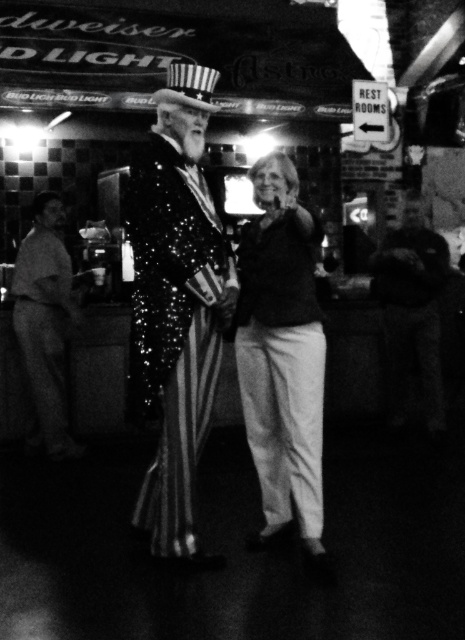
Question: Is sparkly sequined sailor at center smaller than matte black shirt at center?

Choices:
 (A) yes
 (B) no

Answer: (A)

Question: Among these objects, which one is farthest from the camera?

Choices:
 (A) smooth brown leather jacket at left
 (B) sparkly sequined sailor at center
 (C) matte black shirt at center

Answer: (A)

Question: Is matte black shirt at center to the right of smooth brown leather jacket at left from the viewer's perspective?

Choices:
 (A) no
 (B) yes

Answer: (B)

Question: Which point is closer to the camera taking this photo?

Choices:
 (A) click(259, 272)
 (B) click(73, 278)
 (C) click(181, 509)

Answer: (C)

Question: From the image, what is the correct spatial relationship of matte black shirt at center in relation to smooth brown leather jacket at left?

Choices:
 (A) left
 (B) right

Answer: (B)

Question: Which of the following is the closest to the observer?

Choices:
 (A) (219, 360)
 (B) (61, 371)

Answer: (A)